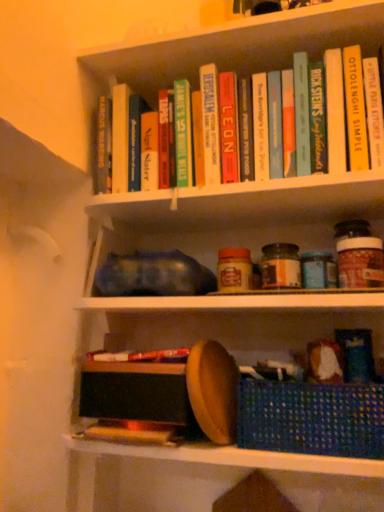
The image size is (384, 512). Find the location of `brown matte glass jar at center-right`. brown matte glass jar at center-right is located at coordinates pyautogui.click(x=280, y=266).

Measure the distance between point (290, 270) and camera.

31.97 inches.

Where is `hardcover book at upper center, the second paperback book viewed from the left`? The image size is (384, 512). hardcover book at upper center, the second paperback book viewed from the left is located at coordinates (229, 127).

In order to face hardcover book at upper center, the 3th paperback book viewed from the left, should I rotate leftwards or rightwards?

To align with it, rotate right about 16.819°.

Measure the distance between hardcover book at center, which is the fourth paperback book in right-to-left order, and camera.

The depth of hardcover book at center, which is the fourth paperback book in right-to-left order, is 32.83 inches.

What do you see at coordinates (311, 418) in the screenshot?
I see `blue woven basket at lower right` at bounding box center [311, 418].

What do you see at coordinates (374, 112) in the screenshot?
I see `hardcover book at upper right, which appears as the 1th paperback book when viewed from the right` at bounding box center [374, 112].

Locate an element on the screen. hardcover book at center is located at coordinates (141, 356).

Can hardcover book at upper right, which is the fourth paperback book in left-to-right order, be found inside hardcover book at center?

No.

Could you measure the distance between hardcover book at center and hardcover book at upper right, which is the fourth paperback book in left-to-right order?

hardcover book at center is 22.14 inches from hardcover book at upper right, which is the fourth paperback book in left-to-right order.

Which of these two, hardcover book at center or hardcover book at upper right, which appears as the 1th paperback book when viewed from the right, stands shorter?

Standing shorter between the two is hardcover book at center.

Is the position of hardcover book at center more distant than that of hardcover book at upper right, which is the fourth paperback book in left-to-right order?

No, the depth of hardcover book at center is less than that of hardcover book at upper right, which is the fourth paperback book in left-to-right order.

In the scene shown: Does hardcover book at upper right, which appears as the 1th paperback book when viewed from the right, have a lesser height compared to hardcover book at center?

Incorrect, the height of hardcover book at upper right, which appears as the 1th paperback book when viewed from the right, does not fall short of that of hardcover book at center.

From a real-world perspective, does hardcover book at upper right, which is the fourth paperback book in left-to-right order, stand above hardcover book at center?

Correct, in the physical world, hardcover book at upper right, which is the fourth paperback book in left-to-right order, is higher than hardcover book at center.

In the scene shown: From the image's perspective, between hardcover book at upper right, which appears as the 1th paperback book when viewed from the right, and hardcover book at center, who is located below?

hardcover book at center.

Does hardcover book at upper center, the 3th paperback book viewed from the left, have a lesser width compared to hardcover book at center, acting as the first paperback book starting from the left?

Correct, the width of hardcover book at upper center, the 3th paperback book viewed from the left, is less than that of hardcover book at center, acting as the first paperback book starting from the left.

Is hardcover book at upper center, the second paperback book when ordered from right to left, inside the boundaries of hardcover book at center, acting as the first paperback book starting from the left, or outside?

hardcover book at upper center, the second paperback book when ordered from right to left, cannot be found inside hardcover book at center, acting as the first paperback book starting from the left.

From a real-world perspective, who is located higher, hardcover book at upper center, the second paperback book when ordered from right to left, or hardcover book at center, acting as the first paperback book starting from the left?

In real-world perspective, hardcover book at upper center, the second paperback book when ordered from right to left, is above.

Between hardcover book at upper center, the second paperback book when ordered from right to left, and hardcover book at center, acting as the first paperback book starting from the left, which one has more height?

hardcover book at upper center, the second paperback book when ordered from right to left.

Who is smaller, brown matte glass jar at center-right or hardcover book at upper right, which is the fourth paperback book in left-to-right order?

hardcover book at upper right, which is the fourth paperback book in left-to-right order.

From a real-world perspective, which is physically below, brown matte glass jar at center-right or hardcover book at upper right, which is the fourth paperback book in left-to-right order?

brown matte glass jar at center-right is physically lower.

Is brown matte glass jar at center-right further to the viewer compared to hardcover book at upper right, which appears as the 1th paperback book when viewed from the right?

Yes, it is.

Considering the sizes of objects brown matte glass jar at center-right and hardcover book at upper right, which is the fourth paperback book in left-to-right order, in the image provided, who is wider, brown matte glass jar at center-right or hardcover book at upper right, which is the fourth paperback book in left-to-right order,?

With larger width is hardcover book at upper right, which is the fourth paperback book in left-to-right order.

Who is more distant, hardcover book at upper center, the second paperback book viewed from the left, or hardcover book at center, which is the fourth paperback book in right-to-left order?

hardcover book at center, which is the fourth paperback book in right-to-left order, is further away from the camera.

In terms of height, does hardcover book at upper center, the second paperback book viewed from the left, look taller or shorter compared to hardcover book at center, which is the fourth paperback book in right-to-left order?

Considering their sizes, hardcover book at upper center, the second paperback book viewed from the left, has more height than hardcover book at center, which is the fourth paperback book in right-to-left order.

Could you tell me if hardcover book at upper center, the second paperback book viewed from the left, is facing hardcover book at center, which is the fourth paperback book in right-to-left order?

No, hardcover book at upper center, the second paperback book viewed from the left, is not facing towards hardcover book at center, which is the fourth paperback book in right-to-left order.

Is hardcover book at upper center, the second paperback book viewed from the left, at the back of hardcover book at center, which is the fourth paperback book in right-to-left order?

hardcover book at center, which is the fourth paperback book in right-to-left order, does not have its back to hardcover book at upper center, the second paperback book viewed from the left.

Who is shorter, hardcover book at center, acting as the first paperback book starting from the left, or hardcover book at upper center, the second paperback book viewed from the left?

hardcover book at center, acting as the first paperback book starting from the left.

From a real-world perspective, which is physically below, hardcover book at center, acting as the first paperback book starting from the left, or hardcover book at upper center, the third paperback book viewed from the right?

From a 3D spatial view, hardcover book at center, acting as the first paperback book starting from the left, is below.

Is point (365, 446) more distant than point (286, 247)?

No, (365, 446) is in front of (286, 247).

In the scene shown: How different are the orientations of blue woven basket at lower right and brown matte glass jar at center-right in degrees?

The angular difference between blue woven basket at lower right and brown matte glass jar at center-right is 1.12 degrees.

From a real-world perspective, is blue woven basket at lower right below brown matte glass jar at center-right?

Correct, in the physical world, blue woven basket at lower right is lower than brown matte glass jar at center-right.

Would you say blue woven basket at lower right is inside or outside brown matte glass jar at center-right?

blue woven basket at lower right exists outside the volume of brown matte glass jar at center-right.

The height and width of the screenshot is (512, 384). I want to click on the 1st paperback book behind the hardcover book at center, starting your count from the anchor, so click(374, 112).

This screenshot has height=512, width=384. I want to click on book on the left of hardcover book at upper right, which is the fourth paperback book in left-to-right order, so click(141, 356).

From the image, which object appears to be farther from hardcover book at center, brown matte glass jar at center-right or blue woven basket at lower right?

brown matte glass jar at center-right lies further to hardcover book at center than the other object.

Which object lies further to the anchor point hardcover book at upper center, the second paperback book when ordered from right to left, blue woven basket at lower right or hardcover book at center, which is the fourth paperback book in right-to-left order?

Among the two, blue woven basket at lower right is located further to hardcover book at upper center, the second paperback book when ordered from right to left.

When comparing their distances from blue woven basket at lower right, does hardcover book at center, which is the fourth paperback book in right-to-left order, or brown matte glass jar at center-right seem further?

hardcover book at center, which is the fourth paperback book in right-to-left order, lies further to blue woven basket at lower right than the other object.

Based on their spatial positions, is brown matte glass jar at center-right or blue woven basket at lower right further from hardcover book at upper center, the 3th paperback book viewed from the left?

blue woven basket at lower right lies further to hardcover book at upper center, the 3th paperback book viewed from the left, than the other object.

From the image, which object appears to be farther from hardcover book at center, brown matte glass jar at center-right or hardcover book at upper center, the 3th paperback book viewed from the left?

hardcover book at upper center, the 3th paperback book viewed from the left, is positioned further to the anchor hardcover book at center.

Looking at the image, which one is located closer to hardcover book at center, hardcover book at upper center, the third paperback book viewed from the right, or blue woven basket at lower right?

blue woven basket at lower right is closer to hardcover book at center.

Considering their positions, is blue woven basket at lower right positioned further to hardcover book at center than brown matte glass jar at center-right?

brown matte glass jar at center-right is further to hardcover book at center.

When comparing their distances from hardcover book at center, which is the fourth paperback book in right-to-left order, does hardcover book at upper right, which appears as the 1th paperback book when viewed from the right, or brown matte glass jar at center-right seem closer?

brown matte glass jar at center-right lies closer to hardcover book at center, which is the fourth paperback book in right-to-left order, than the other object.

Locate an element on the screen. The image size is (384, 512). book between hardcover book at upper right, which appears as the 1th paperback book when viewed from the right, and blue woven basket at lower right vertically is located at coordinates (141, 356).

Locate an element on the screen. This screenshot has width=384, height=512. paperback book situated between hardcover book at center, which is the fourth paperback book in right-to-left order, and hardcover book at upper center, the second paperback book when ordered from right to left, from left to right is located at coordinates (229, 127).

At what (x,y) coordinates should I click in order to perform the action: click on paperback book between hardcover book at upper center, the third paperback book viewed from the right, and brown matte glass jar at center-right from top to bottom. Please return your answer as a coordinate pair (x, y). The height and width of the screenshot is (512, 384). Looking at the image, I should click on (210, 124).

Image resolution: width=384 pixels, height=512 pixels. In order to click on glass jar located between hardcover book at center, which is the fourth paperback book in right-to-left order, and hardcover book at upper right, which is the fourth paperback book in left-to-right order, in the left-right direction in this screenshot , I will do `click(280, 266)`.